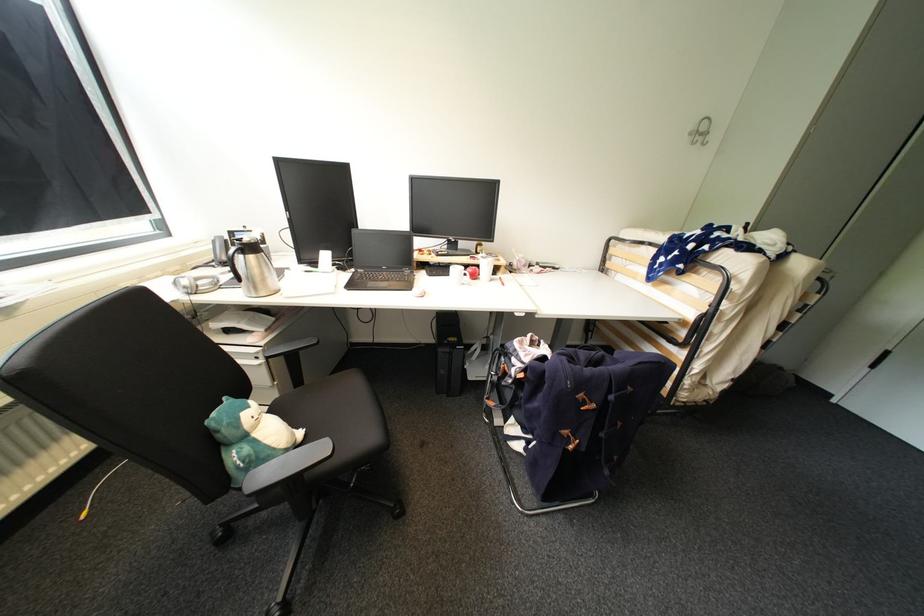
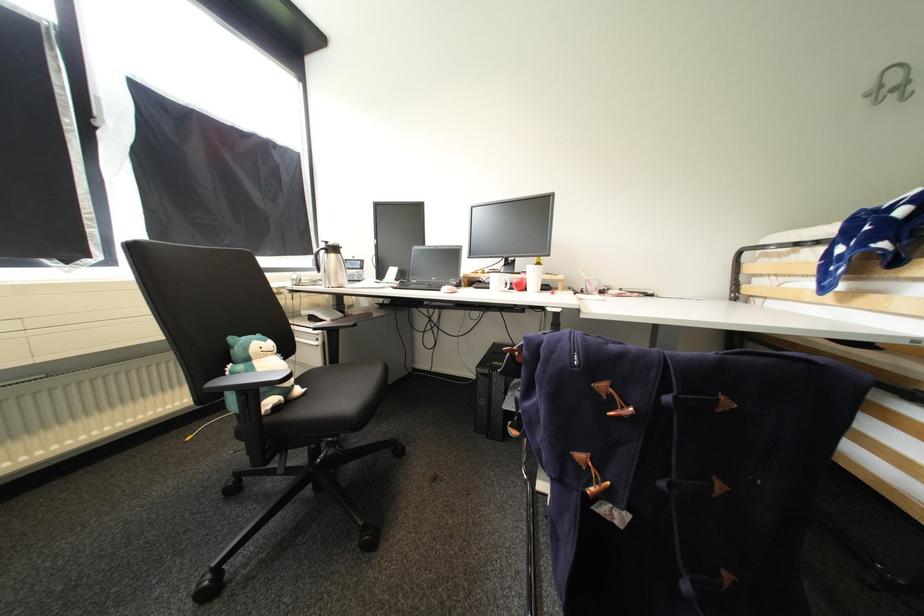
The point at (256, 408) is marked in the first image. Where is the corresponding point in the second image?

(272, 342)